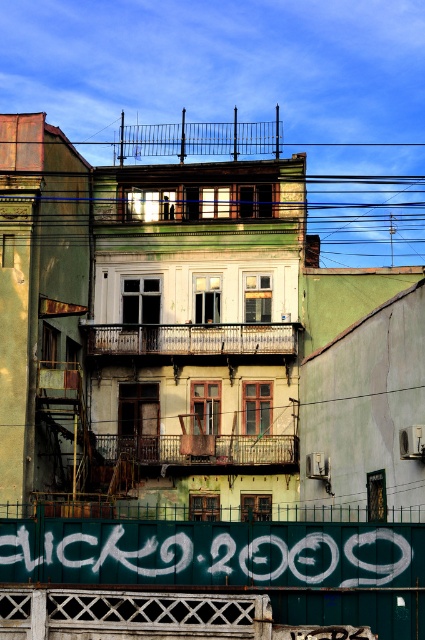
Is white graffiti at center taller than wooden railing at center?

Correct, white graffiti at center is much taller as wooden railing at center.

Find the location of a particular element. white graffiti at center is located at coordinates (210, 554).

This screenshot has width=425, height=640. I want to click on white graffiti at center, so click(x=210, y=554).

Is point (232, 346) closer to camera compared to point (285, 448)?

No, it is not.

Based on the photo, measure the distance between rustic wood balcony at center and wooden railing at center.

rustic wood balcony at center is 3.83 meters away from wooden railing at center.

Between point (286, 353) and point (186, 456), which one is positioned behind?

Point (286, 353)

In order to click on rustic wood balcony at center in this screenshot , I will do `click(192, 339)`.

Which is below, white graffiti at center or rustic wood balcony at center?

white graffiti at center is lower down.

Which is more to the left, white graffiti at center or rustic wood balcony at center?

Positioned to the left is rustic wood balcony at center.

Measure the distance between point [125,541] and camera.

Point [125,541] and camera are 50.52 meters apart from each other.

Find the location of a particular element. This screenshot has width=425, height=640. white graffiti at center is located at coordinates (210, 554).